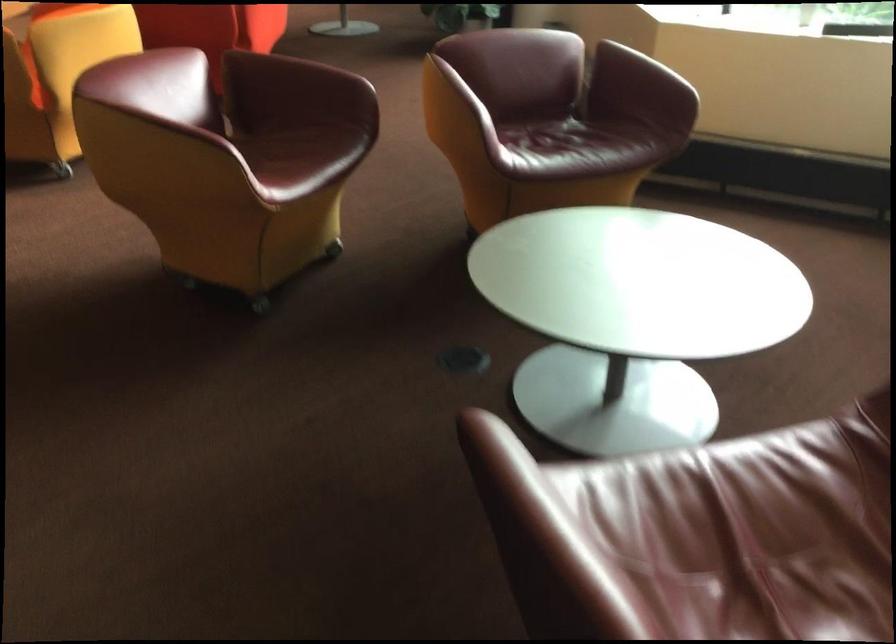
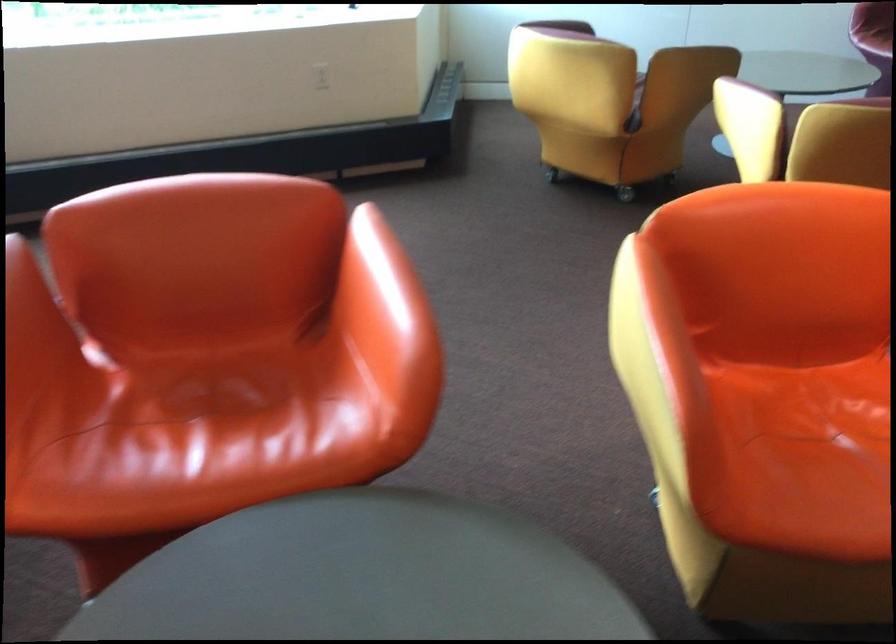
Question: I am providing you with two images of the same scene from different viewpoints. After the viewpoint changes to image2, which objects are now occluded?

Choices:
 (A) red chair sitting surface
 (B) black paper shredder
 (C) purple chair sitting surface
 (D) orange chair sitting surface

Answer: (A)